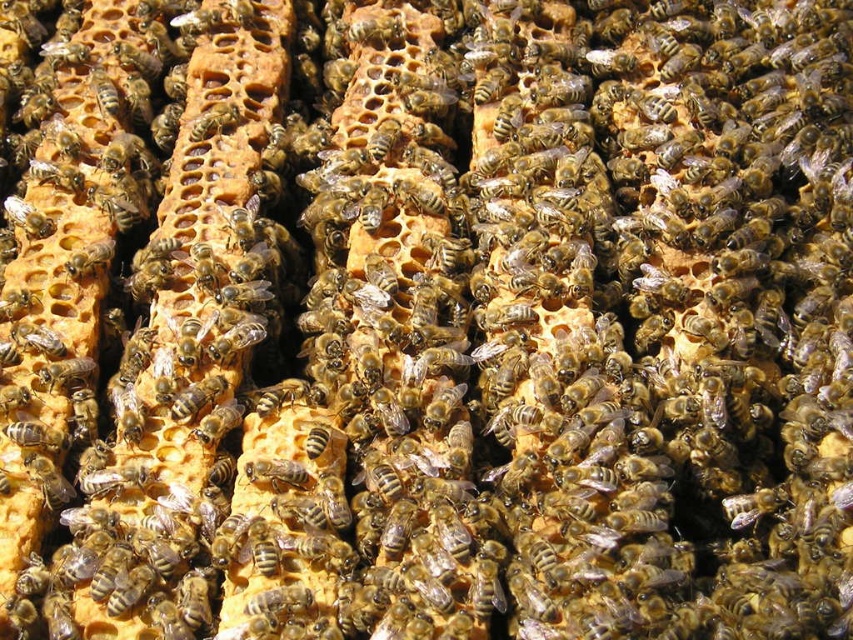
You are a beekeeper observing the beehive and need to locate two specific points marked in the image. The first point is at coordinates point (277, 484) and the second at point (45, 221). From your perspective, which point is closer to you?

Point (277, 484) is in front of point (45, 221), so it is closer to you.

You are a beekeeper observing the beehive. You notice the brown fuzzy bee at center and the translucent golden honeycomb at upper left. Which object is closer to you from your viewpoint?

The brown fuzzy bee at center is closer to you because it is in front of the translucent golden honeycomb at upper left.

You are a beekeeper examining a beehive. You notice a specific point in the hive at coordinates point (276, 472). According to the hive layout, what is located at this point?

The point (276, 472) marks a brown fuzzy bee at center.